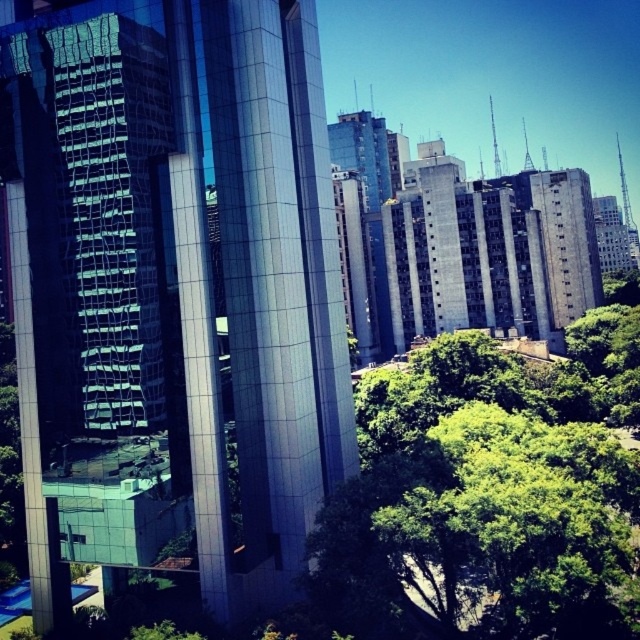
You are standing in the urban landscape and want to locate the point at coordinates [176,278]. According to the scene description, which object does this point belong to?

The point at coordinates [176,278] is on the glossy glass building at center.

You are standing in the urban landscape and want to know how far you are from the point marked as point (337, 275). Can you determine the distance?

The distance between you and point (337, 275) is 57.24 meters.

You are an urban planner assessing the impact of new structures on sunlight access. Given the glossy glass building at center and the green leafy tree at center, which one might cast a longer shadow during midday in this urban area?

The glossy glass building at center is much taller as green leafy tree at center, so it will cast a longer shadow during midday.